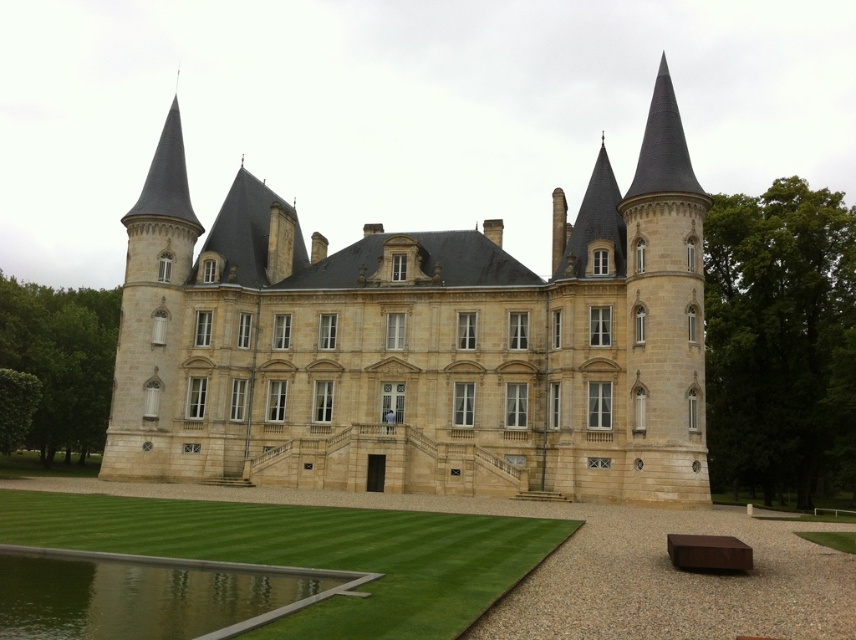
Between beige stone castle at center and green grass lawn at lower center, which one is positioned higher?

beige stone castle at center is higher up.

Locate an element on the screen. This screenshot has height=640, width=856. beige stone castle at center is located at coordinates (419, 342).

Identify the location of beige stone castle at center. (419, 342).

Based on the photo, who is shorter, beige stone castle at center or green reflective water at lower center?

Standing shorter between the two is green reflective water at lower center.

Which is in front, point (377, 316) or point (21, 573)?

Point (21, 573)

The image size is (856, 640). What are the coordinates of `beige stone castle at center` in the screenshot? It's located at (419, 342).

Is green grass lawn at lower center below green reflective water at lower center?

Yes.

Is point (468, 577) closer to camera compared to point (97, 560)?

Yes, point (468, 577) is closer to viewer.

Is point (501, 547) farther from viewer compared to point (117, 605)?

Yes.

You are a GUI agent. You are given a task and a screenshot of the screen. Output one action in this format:
    pyautogui.click(x=<x>, y=<y>)
    Task: Click on the green grass lawn at lower center
    The image size is (856, 640).
    Given the screenshot: What is the action you would take?
    pyautogui.click(x=312, y=552)